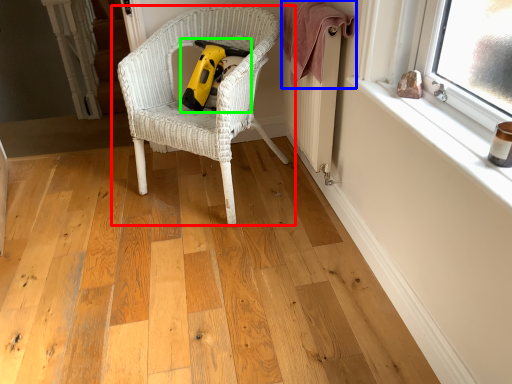
Question: Which object is the closest to the chair (highlighted by a red box)? Choose among these: blanket (highlighted by a blue box) or vacuum (highlighted by a green box).

Choices:
 (A) blanket
 (B) vacuum

Answer: (B)